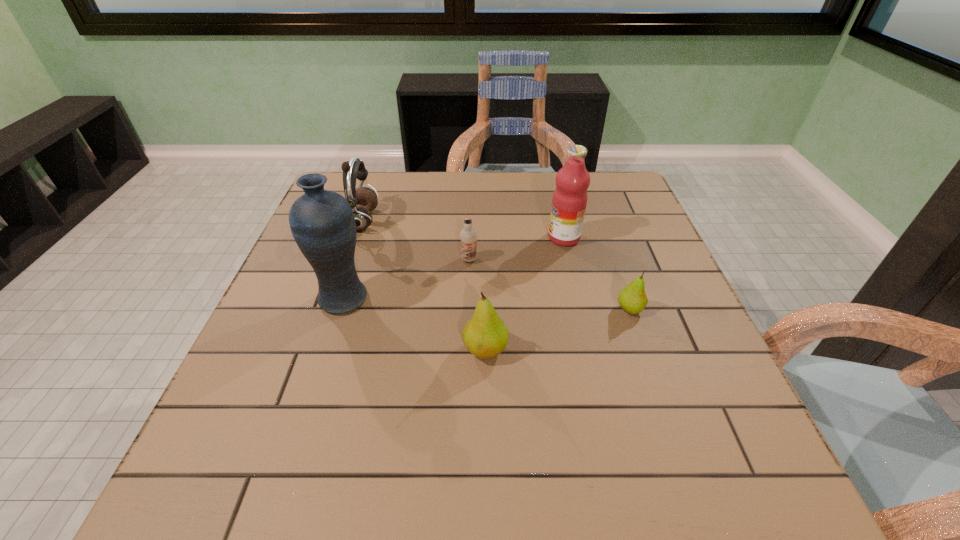
This screenshot has width=960, height=540. In order to click on object that is at the right edge in this screenshot , I will do `click(632, 298)`.

You are a GUI agent. You are given a task and a screenshot of the screen. Output one action in this format:
    pyautogui.click(x=<x>, y=<y>)
    Task: Click on the object at the far left corner
    
    Given the screenshot: What is the action you would take?
    pyautogui.click(x=362, y=200)

This screenshot has width=960, height=540. I want to click on vacant space at the far edge, so click(460, 188).

This screenshot has height=540, width=960. In order to click on vacant space at the near edge of the desktop in this screenshot , I will do `click(383, 395)`.

Where is `vacant space at the left edge of the desktop`? This screenshot has width=960, height=540. vacant space at the left edge of the desktop is located at coordinates (314, 363).

At what (x,y) coordinates should I click in order to perform the action: click on free space at the right edge of the desktop. Please return your answer as a coordinate pair (x, y). The image size is (960, 540). Looking at the image, I should click on (639, 237).

In the image, there is a desktop. Identify the location of vacant area at the near left corner. (243, 397).

You are a GUI agent. You are given a task and a screenshot of the screen. Output one action in this format:
    pyautogui.click(x=<x>, y=<y>)
    Task: Click on the free space at the far right corner of the desktop
    
    Given the screenshot: What is the action you would take?
    pyautogui.click(x=628, y=190)

This screenshot has height=540, width=960. Identify the location of vacant point located between the fourth nearest object and the earphone. (416, 240).

Find the location of `vacant area that lies between the second tallest object and the vase`. vacant area that lies between the second tallest object and the vase is located at coordinates (454, 268).